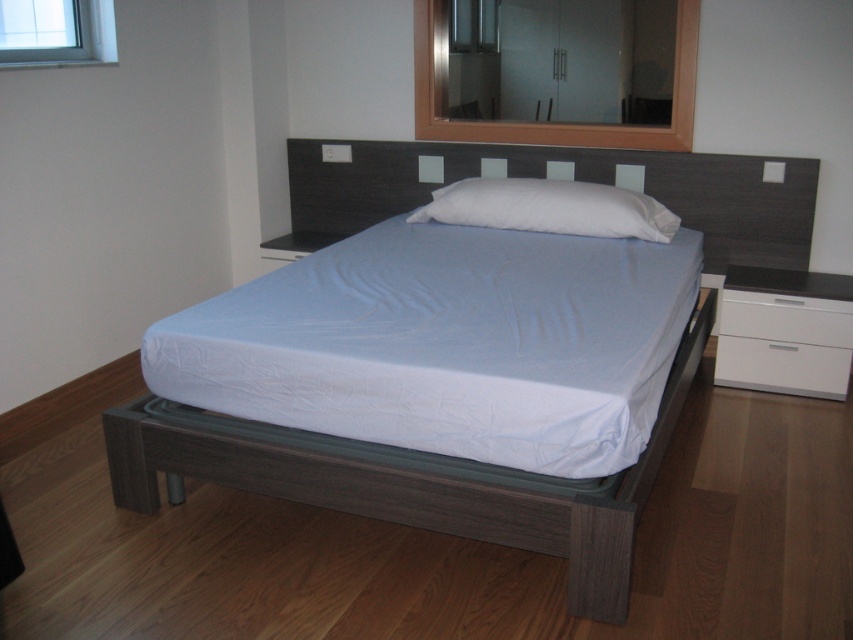
Is point (433, 330) behind point (515, 516)?

Yes, point (433, 330) is farther from viewer.

Is white fabric mattress at center below dark wood bed frame at center?

Incorrect, white fabric mattress at center is not positioned below dark wood bed frame at center.

Who is more forward, (498, 307) or (595, 541)?

Positioned in front is point (595, 541).

I want to click on white fabric mattress at center, so click(x=447, y=342).

Is dark wood bed frame at center closer to the viewer compared to white glossy dresser at right?

Yes, it is in front of white glossy dresser at right.

Identify the location of dark wood bed frame at center. The height and width of the screenshot is (640, 853). (412, 481).

Where is `dark wood bed frame at center`? dark wood bed frame at center is located at coordinates [x=412, y=481].

Is dark wood bed frame at center taller than white soft pillow at center?

Yes, dark wood bed frame at center is taller than white soft pillow at center.

Can you confirm if dark wood bed frame at center is wider than white soft pillow at center?

Indeed, dark wood bed frame at center has a greater width compared to white soft pillow at center.

Where is `dark wood bed frame at center`? The height and width of the screenshot is (640, 853). dark wood bed frame at center is located at coordinates (412, 481).

Locate an element on the screen. The width and height of the screenshot is (853, 640). dark wood bed frame at center is located at coordinates (412, 481).